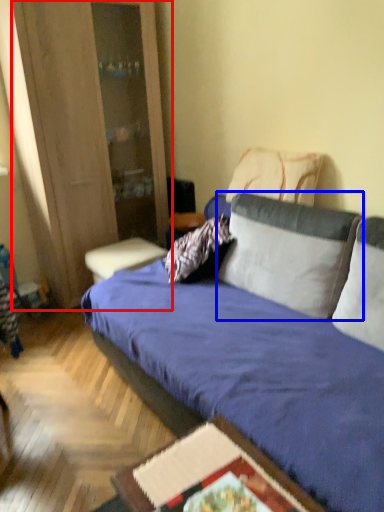
Question: Which object is further to the camera taking this photo, dresser (highlighted by a red box) or pillow (highlighted by a blue box)?

Choices:
 (A) dresser
 (B) pillow

Answer: (A)